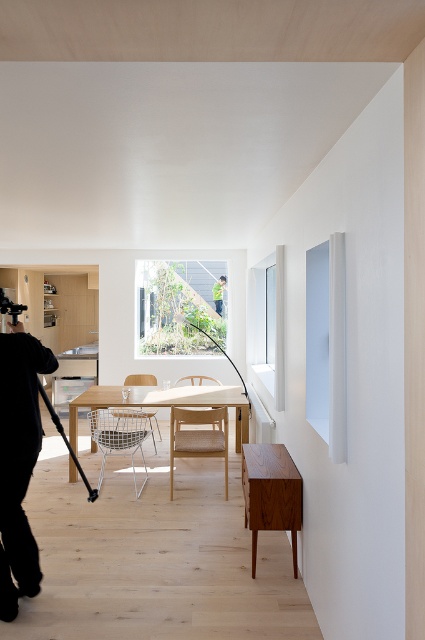
You are a photographer setting up equipment in the dining area. You have a matte black tripod at lower left and a green fabric shirt at upper center. Which object is located higher in the image?

The green fabric shirt at upper center is located higher in the image than the matte black tripod at lower left.

You are a delivery person trying to place a large package that is 3 feet wide between the teak wood sideboard at lower center and the matte black tripod at lower left. Can the package fit in the space between them?

The distance between the teak wood sideboard at lower center and the matte black tripod at lower left is 3.69 feet. Since the package is 3 feet wide, it can fit in the space between them as the available space is wider than the package.

You are setting up photography equipment in the dining area. You have a black fabric camera at left and a matte black tripod at lower left. Which object is taller?

The black fabric camera at left is taller than the matte black tripod at lower left according to the description.